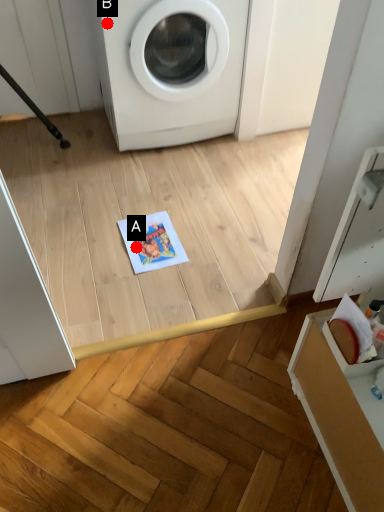
Question: Two points are circled on the image, labeled by A and B beside each circle. Which point appears farthest from the camera in this image?

Choices:
 (A) A is further
 (B) B is further

Answer: (A)